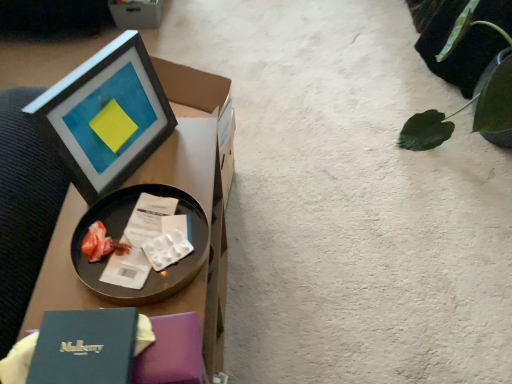
Locate an element on the screen. black glossy tray at upper left is located at coordinates (197, 190).

In order to face matte black picture frame at upper left, should I rotate leftwards or rightwards?

You should look left and rotate roughly 19.595 degrees.

Identify the location of green leafy plant at upper right. (467, 71).

Could you tell me if black glossy tray at upper left is turned towards metallic tray at left?

No, black glossy tray at upper left is not turned towards metallic tray at left.

Considering the positions of points (166, 303) and (81, 262), is point (166, 303) farther from camera compared to point (81, 262)?

No, (166, 303) is in front of (81, 262).

Can you confirm if black glossy tray at upper left is taller than metallic tray at left?

Correct, black glossy tray at upper left is much taller as metallic tray at left.

Considering the positions of point (77, 249) and point (145, 108), is point (77, 249) closer or farther from the camera than point (145, 108)?

Point (77, 249) is positioned closer to the camera compared to point (145, 108).

Is metallic tray at left oriented away from matte black picture frame at upper left?

Answer: No, metallic tray at left's orientation is not away from matte black picture frame at upper left.

Which object is closer to the camera taking this photo, metallic tray at left or matte black picture frame at upper left?

matte black picture frame at upper left is in front.

Where is `tableware below the matte black picture frame at upper left (from a real-world perspective)`? Image resolution: width=512 pixels, height=384 pixels. tableware below the matte black picture frame at upper left (from a real-world perspective) is located at coordinates (120, 237).

Which object is further away from the camera, metallic tray at left or black glossy tray at upper left?

metallic tray at left.

Does point (110, 200) come closer to viewer compared to point (189, 131)?

Yes, it is.

Considering the sizes of objects metallic tray at left and black glossy tray at upper left in the image provided, who is shorter, metallic tray at left or black glossy tray at upper left?

metallic tray at left.

Is point (145, 93) closer or farther from the camera than point (150, 18)?

Point (145, 93) is closer to the camera than point (150, 18).

From a real-world perspective, is matte black picture frame at upper left below cardboard box at upper left?

Actually, matte black picture frame at upper left is physically above cardboard box at upper left in the real world.

Consider the image. From the image's perspective, is matte black picture frame at upper left positioned above or below cardboard box at upper left?

matte black picture frame at upper left is below cardboard box at upper left.

Does matte black picture frame at upper left have a smaller size compared to cardboard box at upper left?

Yes.

How many degrees apart are the facing directions of cardboard box at upper left and metallic tray at left?

The angle between the facing direction of cardboard box at upper left and the facing direction of metallic tray at left is 7.46 degrees.

Is cardboard box at upper left far away from metallic tray at left?

cardboard box at upper left is far away from metallic tray at left.

From a real-world perspective, which is physically above, cardboard box at upper left or metallic tray at left?

metallic tray at left.

Does cardboard box at upper left turn towards metallic tray at left?

No, cardboard box at upper left is not turned towards metallic tray at left.

Image resolution: width=512 pixels, height=384 pixels. What are the coordinates of `table that is above the cardboard box at upper left (from a real-world perspective)` in the screenshot? It's located at (197, 190).

Considering the relative positions of cardboard box at upper left and black glossy tray at upper left in the image provided, is cardboard box at upper left to the left of black glossy tray at upper left from the viewer's perspective?

Correct, you'll find cardboard box at upper left to the left of black glossy tray at upper left.

Looking at the image, does cardboard box at upper left seem bigger or smaller compared to black glossy tray at upper left?

In the image, cardboard box at upper left appears to be smaller than black glossy tray at upper left.

Is black glossy tray at upper left taller or shorter than green leafy plant at upper right?

In the image, black glossy tray at upper left appears to be shorter than green leafy plant at upper right.

Based on the photo, is green leafy plant at upper right located within black glossy tray at upper left?

No.

Who is smaller, black glossy tray at upper left or green leafy plant at upper right?

With smaller size is black glossy tray at upper left.

Which is behind, black glossy tray at upper left or green leafy plant at upper right?

green leafy plant at upper right is behind.

Find the location of `table that is below the metallic tray at left (from the image's perspective)`. table that is below the metallic tray at left (from the image's perspective) is located at coordinates (197, 190).

Where is `picture frame above the metallic tray at left (from a real-world perspective)`? This screenshot has height=384, width=512. picture frame above the metallic tray at left (from a real-world perspective) is located at coordinates (105, 116).

Based on their spatial positions, is black glossy tray at upper left or matte black picture frame at upper left further from green leafy plant at upper right?

matte black picture frame at upper left is positioned further to the anchor green leafy plant at upper right.

Estimate the real-world distances between objects in this image. Which object is further from black glossy tray at upper left, metallic tray at left or green leafy plant at upper right?

green leafy plant at upper right.

Looking at the image, which one is located further to cardboard box at upper left, green leafy plant at upper right or matte black picture frame at upper left?

Based on the image, matte black picture frame at upper left appears to be further to cardboard box at upper left.

Which object lies nearer to the anchor point black glossy tray at upper left, matte black picture frame at upper left or green leafy plant at upper right?

matte black picture frame at upper left is closer to black glossy tray at upper left.

Based on their spatial positions, is metallic tray at left or green leafy plant at upper right closer to matte black picture frame at upper left?

metallic tray at left lies closer to matte black picture frame at upper left than the other object.

Estimate the real-world distances between objects in this image. Which object is closer to matte black picture frame at upper left, black glossy tray at upper left or green leafy plant at upper right?

black glossy tray at upper left lies closer to matte black picture frame at upper left than the other object.

Looking at this image, considering their positions, is matte black picture frame at upper left positioned closer to green leafy plant at upper right than black glossy tray at upper left?

black glossy tray at upper left.

When comparing their distances from green leafy plant at upper right, does cardboard box at upper left or matte black picture frame at upper left seem closer?

matte black picture frame at upper left is closer to green leafy plant at upper right.

You are a GUI agent. You are given a task and a screenshot of the screen. Output one action in this format:
    pyautogui.click(x=<x>, y=<y>)
    Task: Click on the tableware between matte black picture frame at upper left and cardboard box at upper left in the front-back direction
    The height and width of the screenshot is (384, 512).
    Given the screenshot: What is the action you would take?
    pyautogui.click(x=120, y=237)

What are the coordinates of `tableware located between black glossy tray at upper left and green leafy plant at upper right in the left-right direction` in the screenshot? It's located at (120, 237).

The width and height of the screenshot is (512, 384). What are the coordinates of `plant between metallic tray at left and cardboard box at upper left from front to back` in the screenshot? It's located at (467, 71).

The width and height of the screenshot is (512, 384). I want to click on tableware between matte black picture frame at upper left and black glossy tray at upper left in the up-down direction, so click(x=120, y=237).